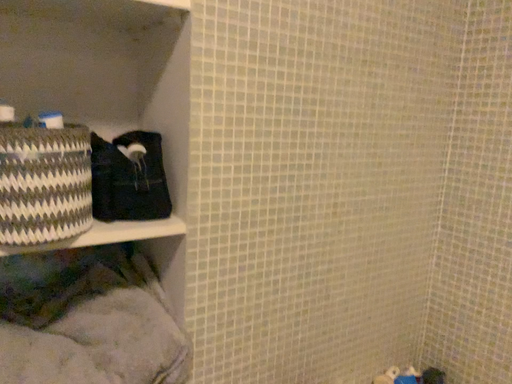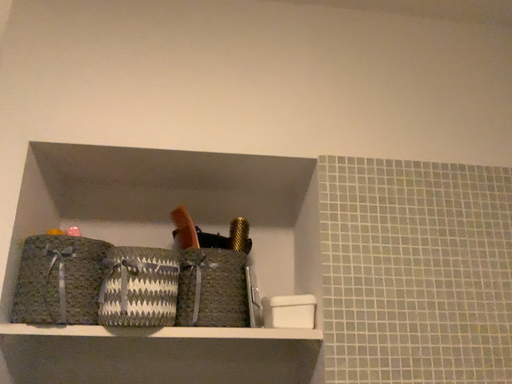
Question: How did the camera likely rotate when shooting the video?

Choices:
 (A) rotated upward
 (B) rotated downward

Answer: (A)